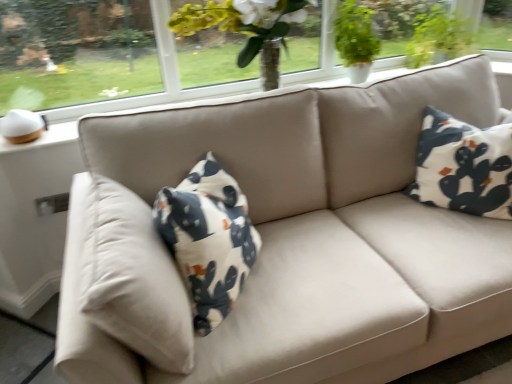
Question: Looking at their shapes, would you say white cotton pillow at right is wider or thinner than green matte plant at upper right?

Choices:
 (A) thin
 (B) wide

Answer: (B)

Question: From a real-world perspective, is white cotton pillow at right positioned above or below green matte plant at upper right?

Choices:
 (A) below
 (B) above

Answer: (A)

Question: Which object is positioned farthest from the white cotton pillow at right?

Choices:
 (A) transparent glass window at upper left
 (B) green matte plant at upper right

Answer: (A)

Question: Considering the real-world distances, which object is farthest from the transparent glass window at upper left?

Choices:
 (A) green matte plant at upper right
 (B) white cotton pillow at right

Answer: (B)